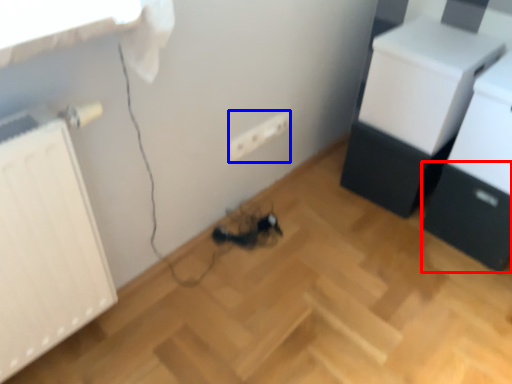
Question: Which object appears closest to the camera in this image, drawer (highlighted by a red box) or electric outlet (highlighted by a blue box)?

Choices:
 (A) drawer
 (B) electric outlet

Answer: (A)